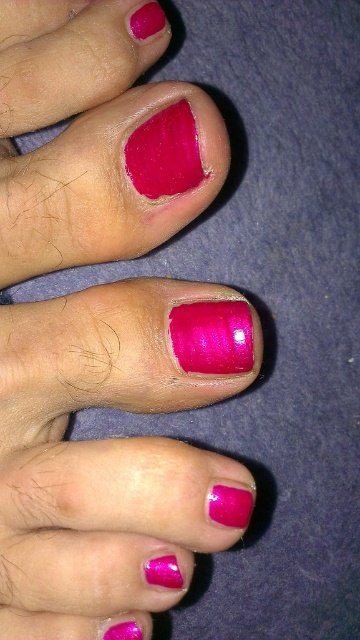
Question: Is glossy pink nail at center below glossy pink nail polish at center?

Choices:
 (A) no
 (B) yes

Answer: (A)

Question: Does glossy pink nail at center have a greater width compared to glossy pink nail polish at center?

Choices:
 (A) no
 (B) yes

Answer: (B)

Question: Which of the following is the closest to the observer?

Choices:
 (A) (210, 364)
 (B) (137, 554)

Answer: (A)

Question: Is the position of glossy pink nail at center more distant than that of glossy pink nail polish at center?

Choices:
 (A) no
 (B) yes

Answer: (A)

Question: Which object appears farthest from the camera in this image?

Choices:
 (A) glossy pink nail at center
 (B) glossy pink nail polish at center

Answer: (B)